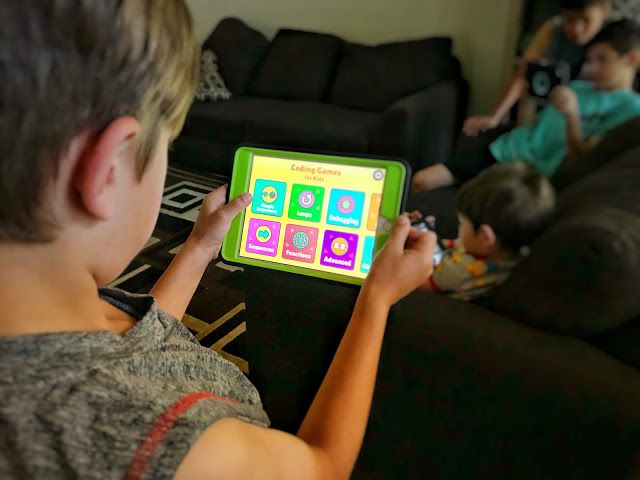
I want to click on sofa pillow, so click(207, 77).